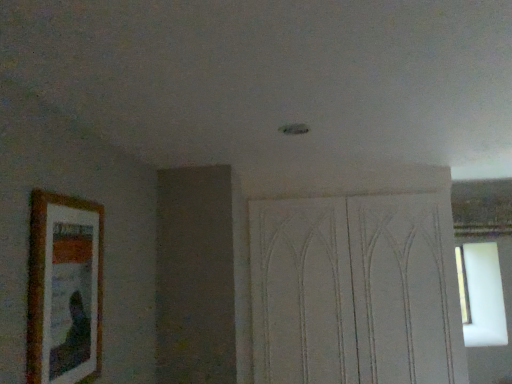
You are a GUI agent. You are given a task and a screenshot of the screen. Output one action in this format:
    pyautogui.click(x=<x>, y=<y>)
    Task: Click on the wooden picture frame at left
    Image resolution: width=512 pixels, height=384 pixels.
    Given the screenshot: What is the action you would take?
    pyautogui.click(x=64, y=289)

This screenshot has width=512, height=384. What do you see at coordinates (64, 289) in the screenshot? I see `wooden picture frame at left` at bounding box center [64, 289].

Consider the image. In order to face white textured screen door at center, should I rotate leftwards or rightwards?

It's best to rotate right around 11.696 degrees.

Locate an element on the screen. This screenshot has height=384, width=512. white textured screen door at center is located at coordinates (354, 277).

The image size is (512, 384). What do you see at coordinates (354, 277) in the screenshot?
I see `white textured screen door at center` at bounding box center [354, 277].

Measure the distance between white textured screen door at center and camera.

white textured screen door at center is 7.02 feet from camera.

Identify the location of wooden picture frame at left. This screenshot has height=384, width=512. (64, 289).

Which is more to the right, white textured screen door at center or wooden picture frame at left?

white textured screen door at center.

Does white textured screen door at center come in front of wooden picture frame at left?

No, it is not.

Is point (395, 331) positioned in front of point (48, 288)?

No, it is behind (48, 288).

From the image's perspective, between white textured screen door at center and wooden picture frame at left, who is located below?

From the image's view, white textured screen door at center is below.

From a real-world perspective, is white textured screen door at center below wooden picture frame at left?

Indeed, from a real-world perspective, white textured screen door at center is positioned beneath wooden picture frame at left.

Between white textured screen door at center and wooden picture frame at left, which one has larger width?

white textured screen door at center.

Is white textured screen door at center shorter than wooden picture frame at left?

No.

Does white textured screen door at center have a smaller size compared to wooden picture frame at left?

Incorrect, white textured screen door at center is not smaller in size than wooden picture frame at left.

Would you say white textured screen door at center contains wooden picture frame at left?

No, wooden picture frame at left is not inside white textured screen door at center.

Is white textured screen door at center next to wooden picture frame at left and touching it?

There is a gap between white textured screen door at center and wooden picture frame at left.

Does white textured screen door at center turn towards wooden picture frame at left?

Yes.

How distant is white textured screen door at center from wooden picture frame at left?

1.32 meters.

You are a GUI agent. You are given a task and a screenshot of the screen. Output one action in this format:
    pyautogui.click(x=<x>, y=<y>)
    Task: Click on the picture frame above the white textured screen door at center (from a real-world perspective)
    
    Given the screenshot: What is the action you would take?
    pyautogui.click(x=64, y=289)

Between wooden picture frame at left and white textured screen door at center, which one appears on the right side from the viewer's perspective?

From the viewer's perspective, white textured screen door at center appears more on the right side.

Between wooden picture frame at left and white textured screen door at center, which one is positioned behind?

Positioned behind is white textured screen door at center.

Does point (32, 198) lie behind point (331, 323)?

No, it is not.

From the picture: From the image's perspective, who appears lower, wooden picture frame at left or white textured screen door at center?

white textured screen door at center is shown below in the image.

In the scene shown: From a real-world perspective, is wooden picture frame at left physically located above or below white textured screen door at center?

Clearly, from a real-world perspective, wooden picture frame at left is above white textured screen door at center.

Does wooden picture frame at left have a lesser width compared to white textured screen door at center?

Yes, wooden picture frame at left is thinner than white textured screen door at center.

Which of these two, wooden picture frame at left or white textured screen door at center, stands taller?

white textured screen door at center is taller.

From the picture: Between wooden picture frame at left and white textured screen door at center, which one has smaller size?

With smaller size is wooden picture frame at left.

Can white textured screen door at center be found inside wooden picture frame at left?

No, white textured screen door at center is not surrounded by wooden picture frame at left.

Is wooden picture frame at left far from white textured screen door at center?

wooden picture frame at left is positioned a significant distance from white textured screen door at center.

Is wooden picture frame at left looking in the opposite direction of white textured screen door at center?

No, wooden picture frame at left is not facing the opposite direction of white textured screen door at center.

Based on the photo, how different are the orientations of wooden picture frame at left and white textured screen door at center in degrees?

They differ by 90.1 degrees in their facing directions.

What are the coordinates of `picture frame above the white textured screen door at center (from a real-world perspective)` in the screenshot? It's located at (64, 289).

Where is `picture frame that is on the left side of white textured screen door at center`? Image resolution: width=512 pixels, height=384 pixels. picture frame that is on the left side of white textured screen door at center is located at coordinates (64, 289).

Where is `screen door that is behind the wooden picture frame at left`? screen door that is behind the wooden picture frame at left is located at coordinates (354, 277).